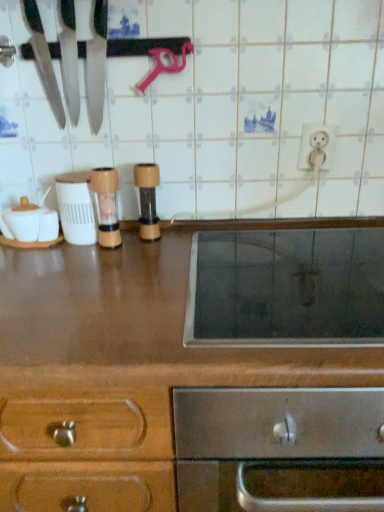
At what (x,y) coordinates should I click in order to perform the action: click on vacant area that lies in front of brown wood pepper grinder at center, the first appliance when ordered from right to left. Please return your answer as a coordinate pair (x, y). Looking at the image, I should click on (146, 263).